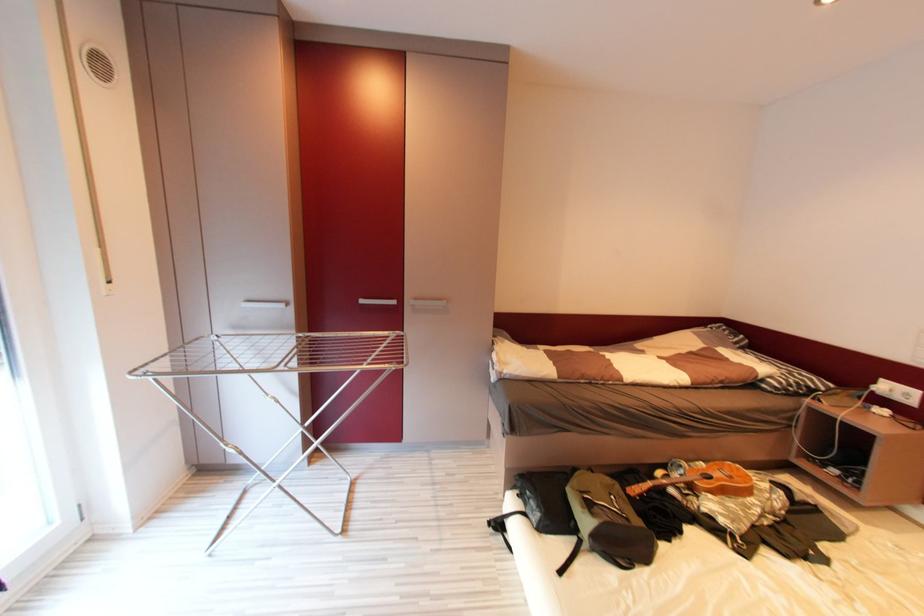
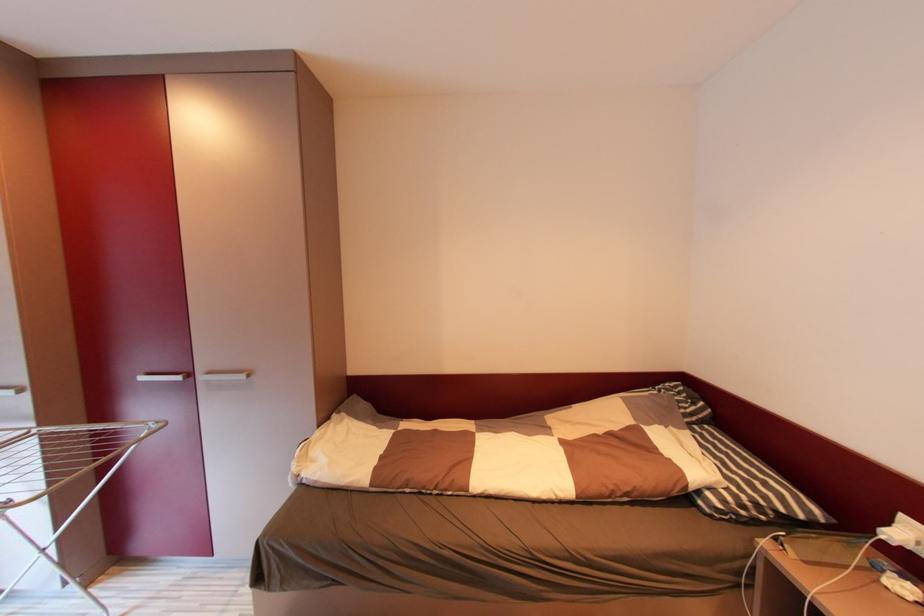
Consider the image. In a continuous first-person perspective shot, in which direction is the camera moving?

The cameraman moved toward right, forward.